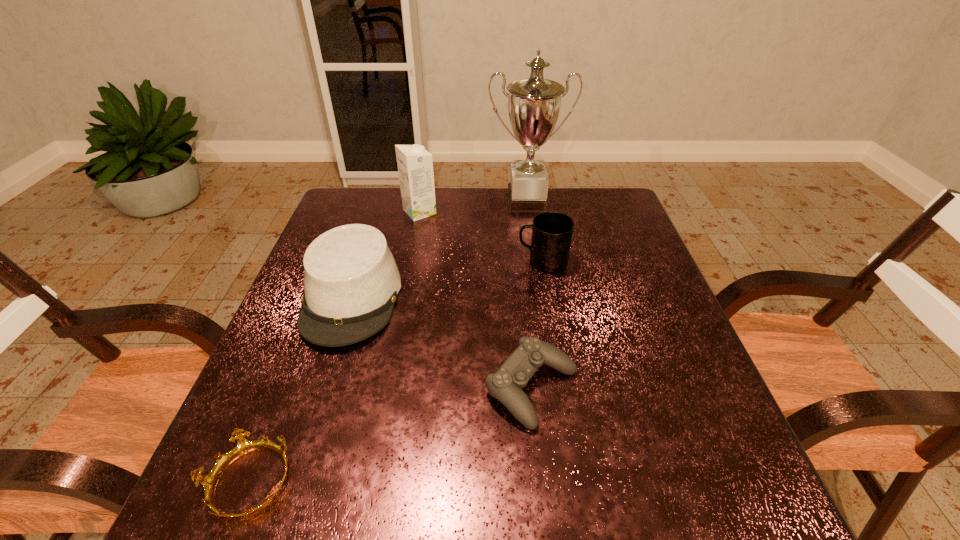
Where is `free space at the far edge`? This screenshot has height=540, width=960. free space at the far edge is located at coordinates (412, 224).

At what (x,y) coordinates should I click in order to perform the action: click on vacant region at the near edge. Please return your answer as a coordinate pair (x, y). Looking at the image, I should click on (532, 480).

Locate an element on the screen. The height and width of the screenshot is (540, 960). vacant space at the left edge of the desktop is located at coordinates (294, 339).

What are the coordinates of `free space at the right edge of the desktop` in the screenshot? It's located at (624, 233).

Identify the location of free space at the far left corner of the desktop. (378, 212).

Where is `free space at the near left corner of the desktop`? free space at the near left corner of the desktop is located at coordinates [x=236, y=523].

What are the coordinates of `free location at the far right corner` in the screenshot? It's located at (587, 222).

Find the location of a particular element. This screenshot has height=540, width=960. vacant space that is in between the hat and the mug is located at coordinates (447, 279).

The image size is (960, 540). What are the coordinates of `free space between the mug and the hat` in the screenshot? It's located at (447, 279).

Where is `free space that is in between the trophy cup and the control`? The image size is (960, 540). free space that is in between the trophy cup and the control is located at coordinates (529, 294).